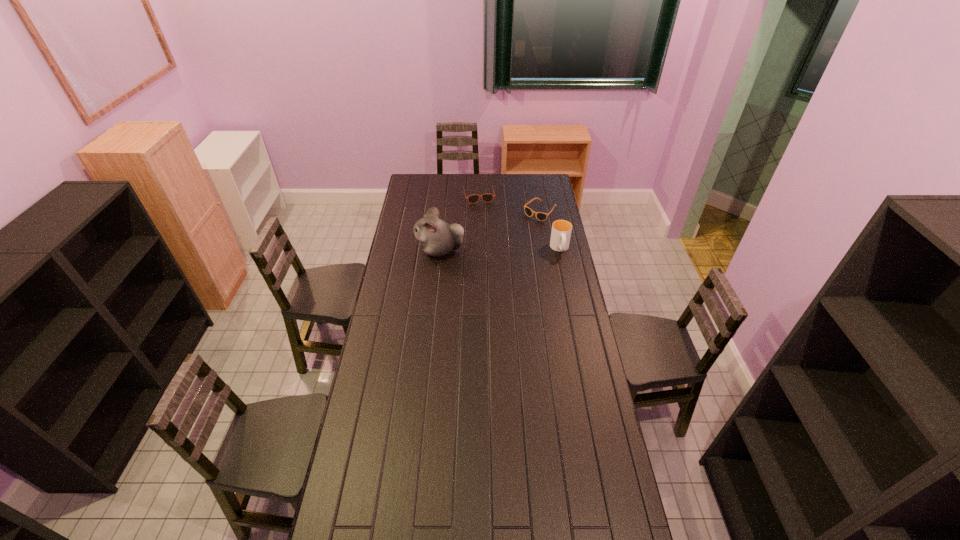
This screenshot has height=540, width=960. Find the location of `free area in between the third shortest object and the tallest object`. free area in between the third shortest object and the tallest object is located at coordinates (500, 249).

The width and height of the screenshot is (960, 540). In order to click on object that can be found as the second closest to the right sunglasses in this screenshot , I will do `click(487, 197)`.

Point out which object is positioned as the second nearest to the cup. Please provide its 2D coordinates. Your answer should be formatted as a tuple, i.e. [(x, y)], where the tuple contains the x and y coordinates of a point satisfying the conditions above.

[(487, 197)]